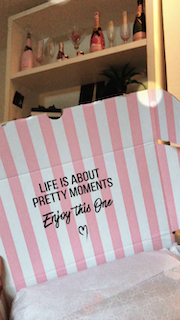
Where is `3 bottles of champagne`? The image size is (180, 320). 3 bottles of champagne is located at coordinates (142, 25), (97, 35), (27, 53).